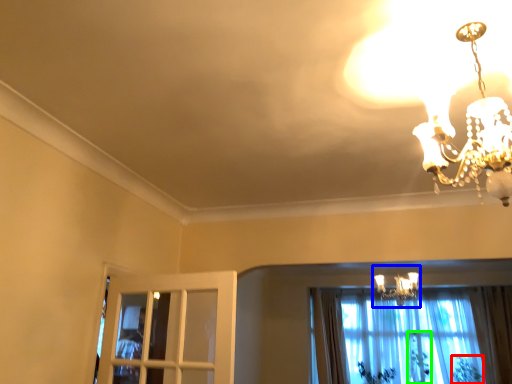
Question: Which is nearer to the plant (highlighted by a red box)? lamp (highlighted by a blue box) or plant (highlighted by a green box).

Choices:
 (A) lamp
 (B) plant

Answer: (B)